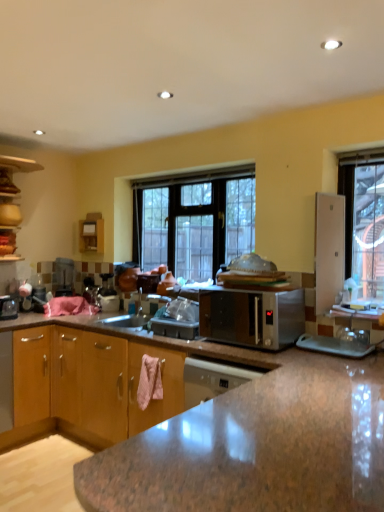
Question: From a real-world perspective, does satin silver microwave at center sit lower than clear glass window at center?

Choices:
 (A) yes
 (B) no

Answer: (A)

Question: Does satin silver microwave at center turn towards clear glass window at center?

Choices:
 (A) no
 (B) yes

Answer: (A)

Question: Can you confirm if satin silver microwave at center is thinner than clear glass window at center?

Choices:
 (A) no
 (B) yes

Answer: (A)

Question: Does satin silver microwave at center have a lesser height compared to clear glass window at center?

Choices:
 (A) no
 (B) yes

Answer: (B)

Question: Is satin silver microwave at center further to the viewer compared to clear glass window at center?

Choices:
 (A) yes
 (B) no

Answer: (B)

Question: From the image's perspective, does satin silver microwave at center appear higher than clear glass window at center?

Choices:
 (A) no
 (B) yes

Answer: (A)

Question: Is brown wood cabinet at lower left, acting as the second cabinetry starting from the top, not within wooden cabinet at left, the first cabinetry when ordered from top to bottom?

Choices:
 (A) yes
 (B) no

Answer: (A)

Question: From a real-world perspective, is brown wood cabinet at lower left, acting as the second cabinetry starting from the top, positioned over wooden cabinet at left, arranged as the 1th cabinetry when viewed from the left, based on gravity?

Choices:
 (A) yes
 (B) no

Answer: (B)

Question: Is the depth of brown wood cabinet at lower left, acting as the second cabinetry starting from the top, less than that of wooden cabinet at left, which appears as the second cabinetry when viewed from the front?

Choices:
 (A) yes
 (B) no

Answer: (A)

Question: Does brown wood cabinet at lower left, acting as the second cabinetry starting from the top, have a larger size compared to wooden cabinet at left, acting as the second cabinetry starting from the right?

Choices:
 (A) yes
 (B) no

Answer: (A)

Question: From the image's perspective, is brown wood cabinet at lower left, acting as the second cabinetry starting from the top, above wooden cabinet at left, arranged as the 1th cabinetry when viewed from the left?

Choices:
 (A) yes
 (B) no

Answer: (B)

Question: Is brown wood cabinet at lower left, placed as the 1th cabinetry when sorted from right to left, turned away from wooden cabinet at left, the first cabinetry when ordered from top to bottom?

Choices:
 (A) no
 (B) yes

Answer: (A)

Question: Is wooden cabinet at left, arranged as the 1th cabinetry when viewed from the left, positioned beyond the bounds of brown wood cabinet at lower left, which is the 2th cabinetry in left-to-right order?

Choices:
 (A) yes
 (B) no

Answer: (A)